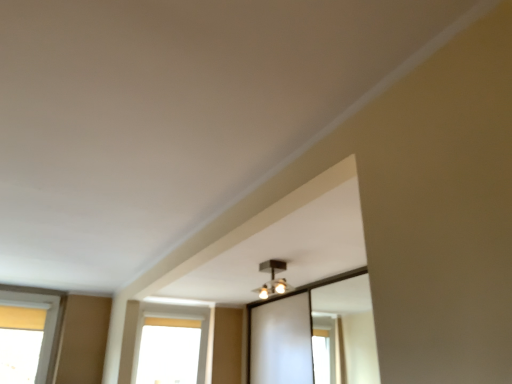
Question: Can you confirm if transparent glass window at lower center is positioned to the right of matte black light fixture at upper center?

Choices:
 (A) no
 (B) yes

Answer: (A)

Question: Can you confirm if transparent glass window at lower center is bigger than matte black light fixture at upper center?

Choices:
 (A) yes
 (B) no

Answer: (A)

Question: Can you confirm if transparent glass window at lower center is positioned to the left of matte black light fixture at upper center?

Choices:
 (A) no
 (B) yes

Answer: (B)

Question: Is transparent glass window at lower center oriented away from matte black light fixture at upper center?

Choices:
 (A) yes
 (B) no

Answer: (B)

Question: Does transparent glass window at lower center touch matte black light fixture at upper center?

Choices:
 (A) yes
 (B) no

Answer: (B)

Question: From the image's perspective, is transparent glass window at lower center located beneath matte black light fixture at upper center?

Choices:
 (A) no
 (B) yes

Answer: (B)

Question: Is matte black light fixture at upper center thinner than transparent glass window at lower center?

Choices:
 (A) no
 (B) yes

Answer: (A)

Question: Considering the relative sizes of matte black light fixture at upper center and transparent glass window at lower center in the image provided, is matte black light fixture at upper center smaller than transparent glass window at lower center?

Choices:
 (A) no
 (B) yes

Answer: (B)

Question: Is matte black light fixture at upper center shorter than transparent glass window at lower center?

Choices:
 (A) yes
 (B) no

Answer: (A)

Question: From the image's perspective, is matte black light fixture at upper center below transparent glass window at lower center?

Choices:
 (A) yes
 (B) no

Answer: (B)

Question: Is matte black light fixture at upper center oriented away from transparent glass window at lower center?

Choices:
 (A) yes
 (B) no

Answer: (A)

Question: Can we say matte black light fixture at upper center lies outside transparent glass window at lower center?

Choices:
 (A) no
 (B) yes

Answer: (B)

Question: In the image, is matte black light fixture at upper center positioned in front of or behind transparent glass window at lower center?

Choices:
 (A) front
 (B) behind

Answer: (A)